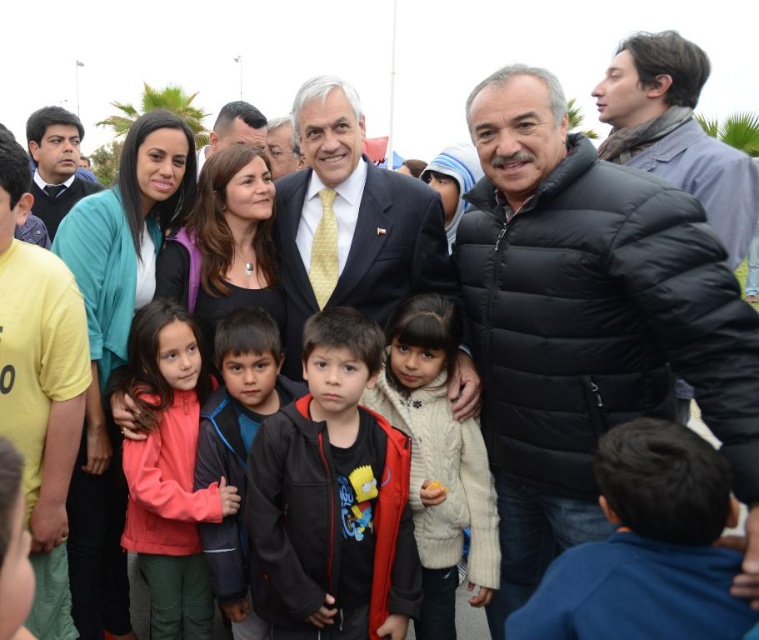
Can you confirm if matte black suit at center is smaller than white fuzzy sweater at center?

No, matte black suit at center is not smaller than white fuzzy sweater at center.

Is matte black suit at center behind white fuzzy sweater at center?

Yes, matte black suit at center is behind white fuzzy sweater at center.

Describe the element at coordinates (348, 221) in the screenshot. I see `matte black suit at center` at that location.

At what (x,y) coordinates should I click in order to perform the action: click on matte black suit at center. Please return your answer as a coordinate pair (x, y). The image size is (759, 640). Looking at the image, I should click on (348, 221).

Between matte pink jacket at center and black jacket at center, which one is positioned higher?

matte pink jacket at center is higher up.

Can you confirm if matte pink jacket at center is positioned to the right of black jacket at center?

Incorrect, matte pink jacket at center is not on the right side of black jacket at center.

Does point (164, 346) come closer to viewer compared to point (225, 429)?

No, it is behind (225, 429).

You are a GUI agent. You are given a task and a screenshot of the screen. Output one action in this format:
    pyautogui.click(x=<x>, y=<y>)
    Task: Click on the matte pink jacket at center
    This screenshot has height=640, width=759.
    Given the screenshot: What is the action you would take?
    pyautogui.click(x=169, y=472)

Is matte black shirt at left to the left of white fuzzy sweater at center from the viewer's perspective?

Indeed, matte black shirt at left is positioned on the left side of white fuzzy sweater at center.

Locate an element on the screen. Image resolution: width=759 pixels, height=640 pixels. matte black shirt at left is located at coordinates (39, 387).

This screenshot has width=759, height=640. Identify the location of matte black shirt at left. pyautogui.click(x=39, y=387).

You are a GUI agent. You are given a task and a screenshot of the screen. Output one action in this format:
    pyautogui.click(x=<x>, y=<y>)
    Task: Click on the matte black shirt at left
    This screenshot has height=640, width=759.
    Given the screenshot: What is the action you would take?
    pyautogui.click(x=39, y=387)